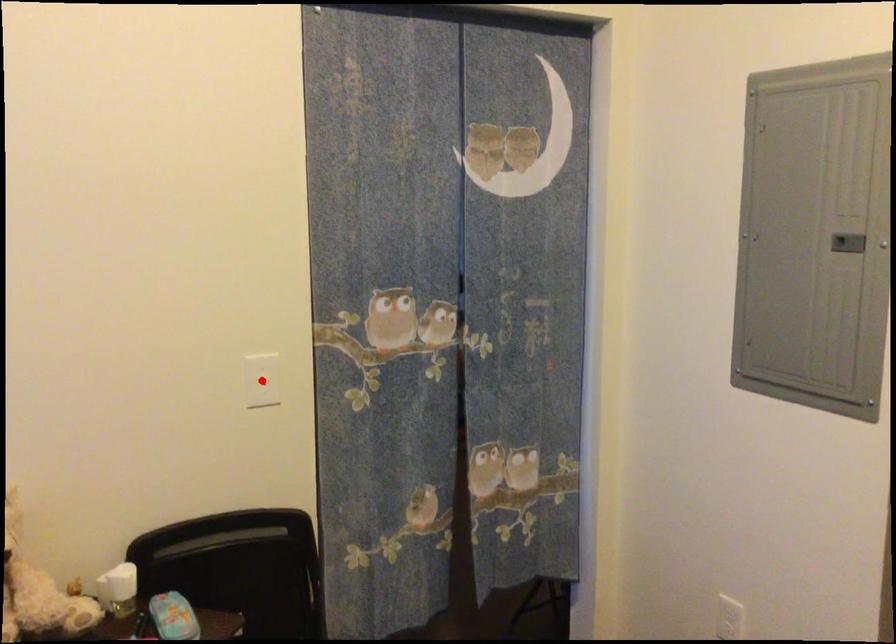
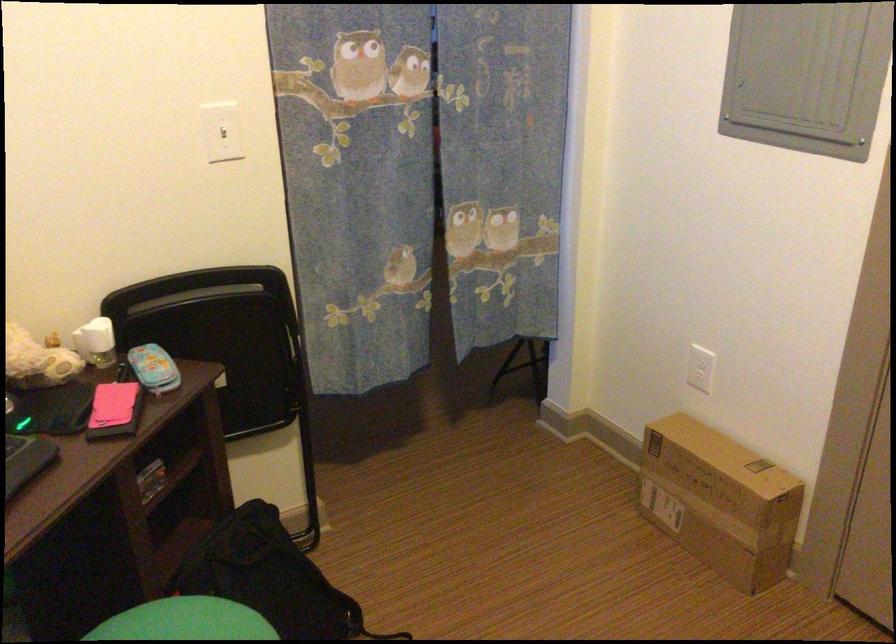
In the second image, find the point that corresponds to the highlighted location in the first image.

(222, 131)